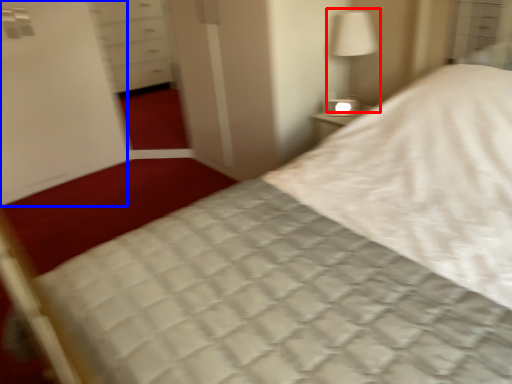
Question: Which object is further to the camera taking this photo, bedside lamp (highlighted by a red box) or screen door (highlighted by a blue box)?

Choices:
 (A) bedside lamp
 (B) screen door

Answer: (B)